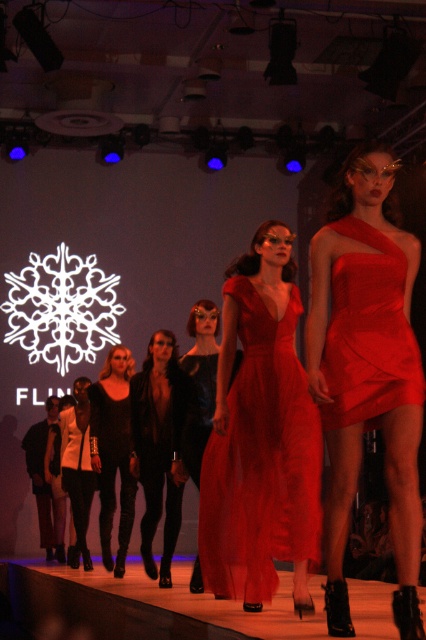
Question: Is shiny satin dress at center to the right of satin dress at center from the viewer's perspective?

Choices:
 (A) yes
 (B) no

Answer: (A)

Question: Is satin dress at center thinner than satin/red dress at center?

Choices:
 (A) yes
 (B) no

Answer: (B)

Question: Can you confirm if satin black dress at center is smaller than white matte jacket at center?

Choices:
 (A) no
 (B) yes

Answer: (B)

Question: Which point is farther to the camera?

Choices:
 (A) (109, 378)
 (B) (365, 337)

Answer: (A)

Question: Which point is closer to the camera taking this photo?

Choices:
 (A) (207, 380)
 (B) (229, 422)

Answer: (B)

Question: Based on their relative distances, which object is nearer to the shiny satin dress at center?

Choices:
 (A) black leather jacket at center
 (B) satin black dress at center
 (C) white matte jacket at center
 (D) satin dress at center

Answer: (D)